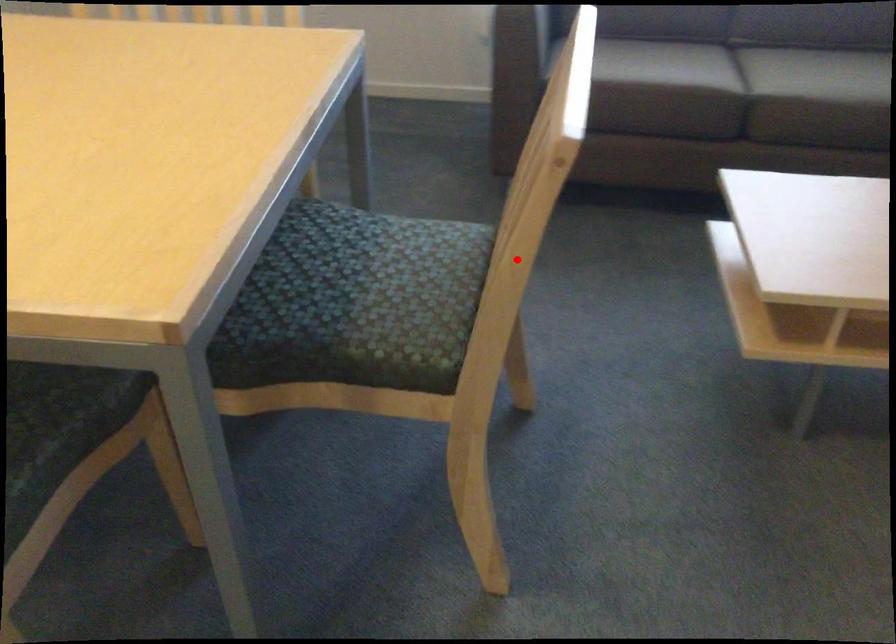
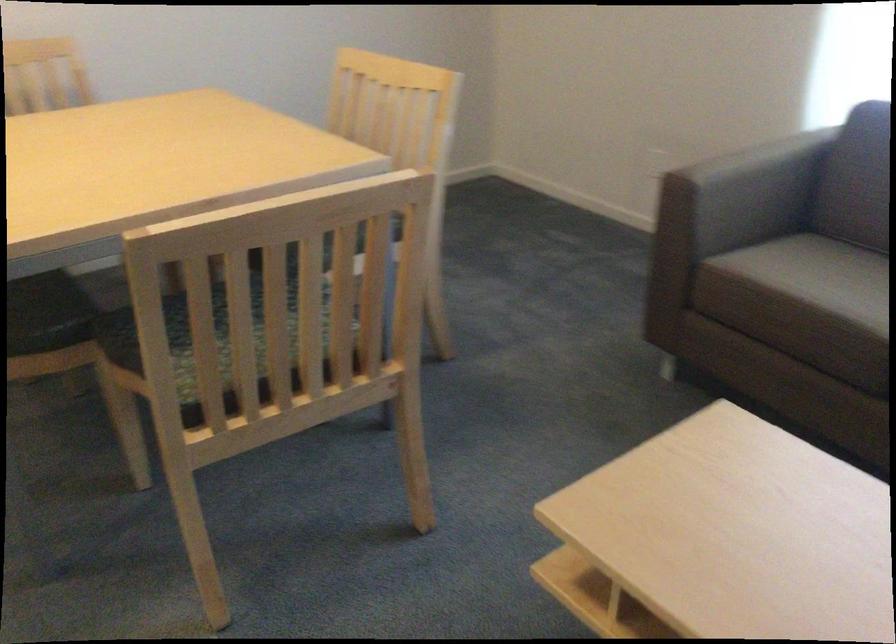
The point at the highlighted location is marked in the first image. Where is the corresponding point in the second image?

(211, 334)